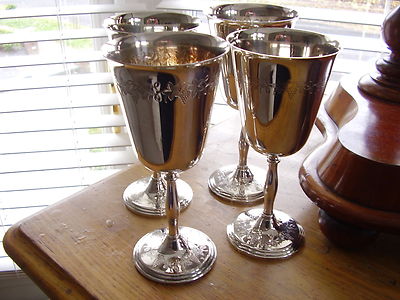
I want to click on silver cups, so click(173, 140), click(247, 10), click(158, 40), click(166, 27).